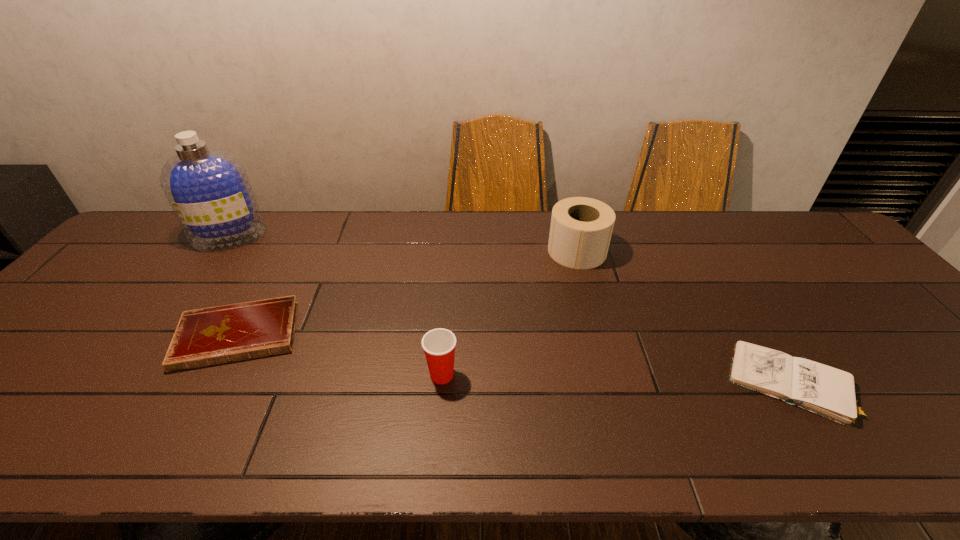
This screenshot has height=540, width=960. I want to click on the tallest object, so click(x=208, y=189).

In order to click on toilet tissue in this screenshot , I will do click(581, 228).

The height and width of the screenshot is (540, 960). In order to click on the second tallest object in this screenshot , I will do `click(581, 228)`.

This screenshot has width=960, height=540. I want to click on the third tallest object, so click(x=438, y=344).

This screenshot has height=540, width=960. I want to click on Dixie cup, so (438, 344).

Where is `the left notebook`? the left notebook is located at coordinates (209, 336).

Find the location of a particular element. This screenshot has height=540, width=960. the right notebook is located at coordinates (829, 392).

Identify the location of vacant space located on the left of the tallest object. (171, 236).

This screenshot has height=540, width=960. Find the location of `vacant space located 0.130m on the right of the toilet tissue`. vacant space located 0.130m on the right of the toilet tissue is located at coordinates (649, 251).

This screenshot has width=960, height=540. I want to click on vacant region located 0.170m on the back of the third object from left to right, so click(447, 310).